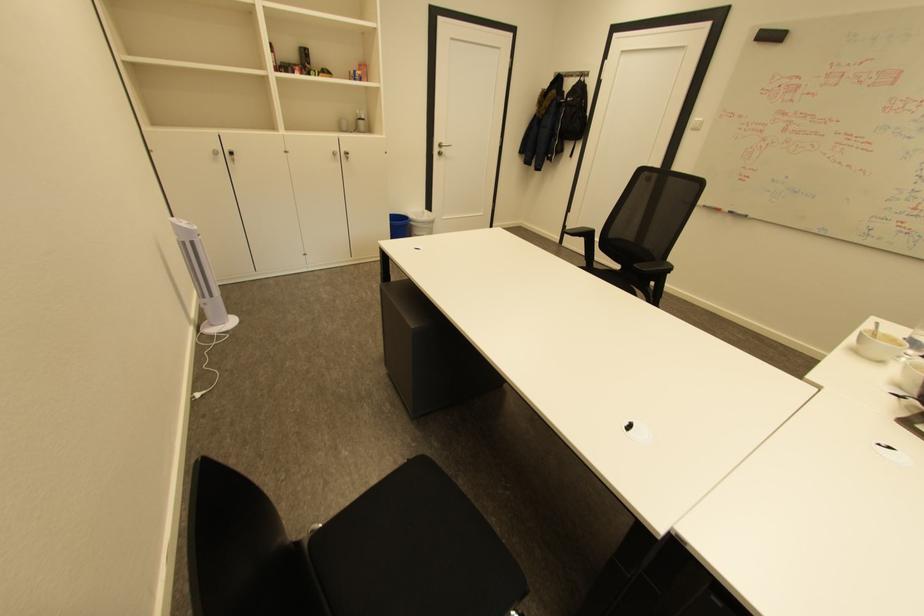
The location [398,225] corresponds to which object?

This point indicates the blue trash can.